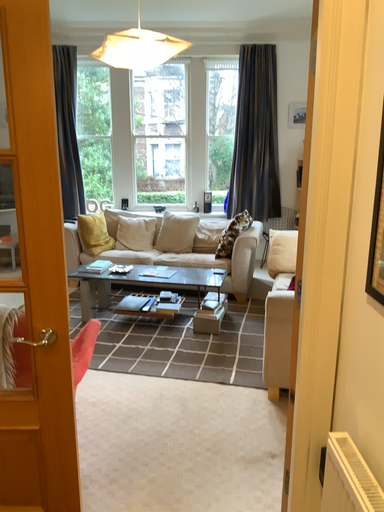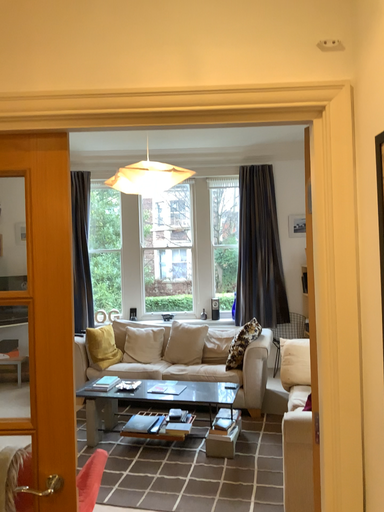
Question: Which way did the camera rotate in the video?

Choices:
 (A) rotated upward
 (B) rotated downward

Answer: (A)